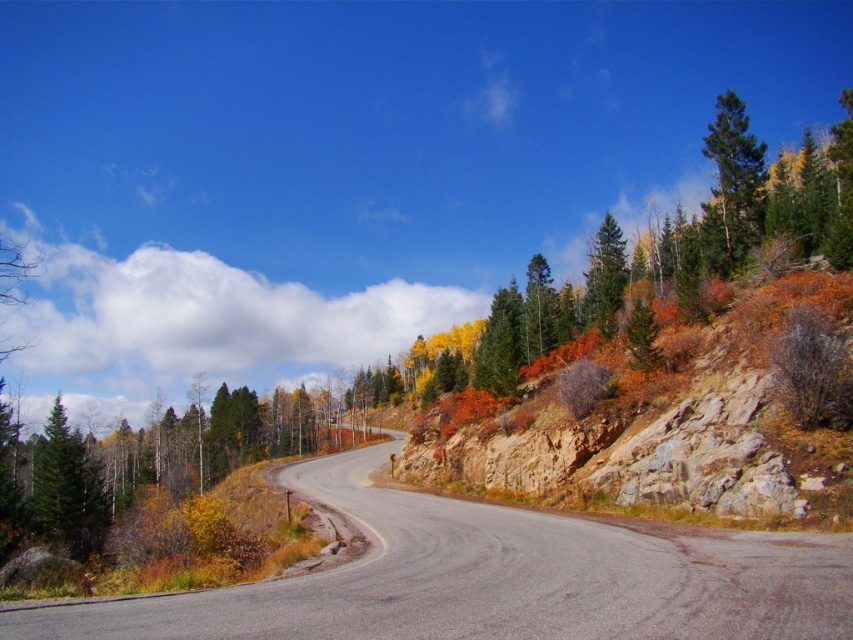
You are a hiker standing on the scenic road and looking at the green matte tree at left and the green matte tree at upper center. Which tree is closer to you?

The green matte tree at left is positioned under the green matte tree at upper center, which means it is closer to you.

Consider the image. You are driving along the scenic road and notice two green matte trees in your view. Which one would appear closer to you, the green matte tree at left or the green matte tree at upper center?

The green matte tree at left appears closer because it is bigger than the green matte tree at upper center.

In the scene shown: You are driving along the asphalt road at center and want to park near the green matte tree at upper right. Which direction should you turn to reach the tree from the road?

The asphalt road at center is to the left of the green matte tree at upper right, so you should turn to the right to reach the tree from the road.